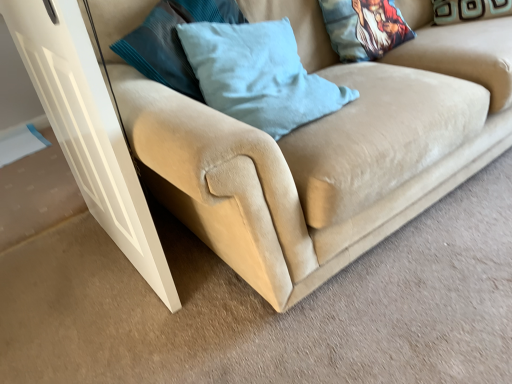
Question: Do you think light blue fabric pillow at center, arranged as the first pillow when viewed from the left, is within teal velvet pillow at upper right, marked as the first pillow in a right-to-left arrangement, or outside of it?

Choices:
 (A) inside
 (B) outside

Answer: (B)

Question: From a real-world perspective, is light blue fabric pillow at center, arranged as the first pillow when viewed from the left, positioned above or below teal velvet pillow at upper right, marked as the first pillow in a right-to-left arrangement?

Choices:
 (A) above
 (B) below

Answer: (A)

Question: Which is nearer to the light blue fabric pillow at center, arranged as the first pillow when viewed from the left?

Choices:
 (A) teal velvet pillow at upper right, marked as the first pillow in a right-to-left arrangement
 (B) white glossy door at lower left
 (C) beige suede couch at lower left
 (D) printed fabric pillow at upper right, the 2th pillow from the left

Answer: (C)

Question: Estimate the real-world distances between objects in this image. Which object is closer to the teal velvet pillow at upper right, marked as the first pillow in a right-to-left arrangement?

Choices:
 (A) light blue fabric pillow at center, the third pillow when ordered from right to left
 (B) beige suede couch at lower left
 (C) printed fabric pillow at upper right, the 2th pillow viewed from the right
 (D) white glossy door at lower left

Answer: (C)